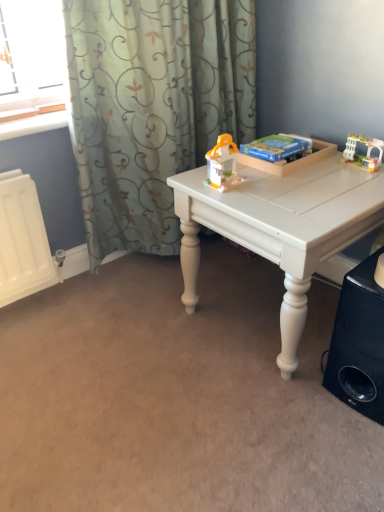
I want to click on vacant space in front of white matte table at center, so click(x=251, y=430).